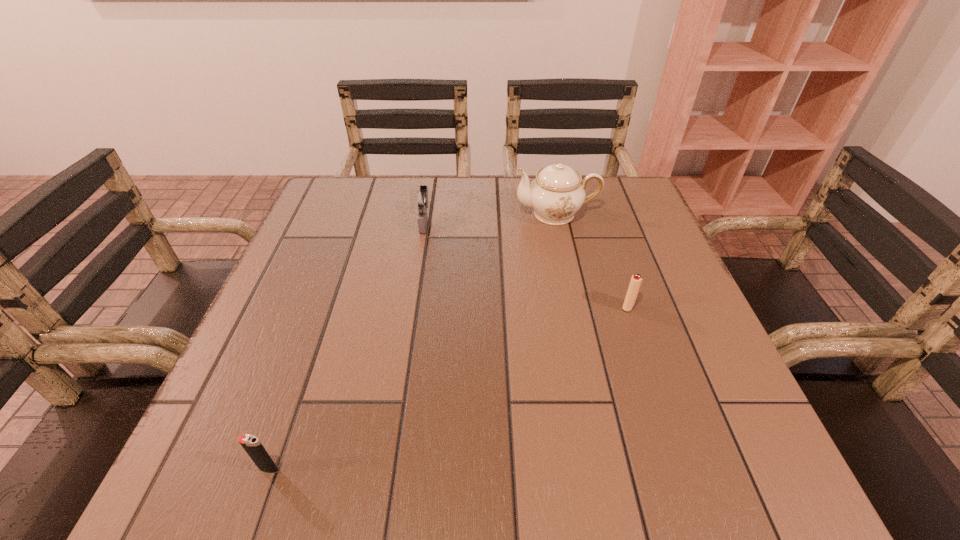
Locate an element on the screen. free space located 0.390m on the front of the tallest igniter is located at coordinates (402, 372).

Identify the location of vacant position located on the right of the leftmost object. This screenshot has height=540, width=960. (464, 469).

At what (x,y) coordinates should I click in order to perform the action: click on vacant position located 0.050m on the right of the second nearest object. Please return your answer as a coordinate pair (x, y). This screenshot has height=540, width=960. Looking at the image, I should click on (660, 307).

What are the coordinates of `chinaware located at the far edge` in the screenshot? It's located at (556, 194).

Image resolution: width=960 pixels, height=540 pixels. Identify the location of igniter located at the far edge. pos(421,199).

Where is `object at the near edge`? object at the near edge is located at coordinates pos(251,444).

Identify the location of object present at the left edge. The image size is (960, 540). (251, 444).

Image resolution: width=960 pixels, height=540 pixels. What are the coordinates of `chinaware that is at the right edge` in the screenshot? It's located at (556, 194).

Find the location of a particular element. The width and height of the screenshot is (960, 540). igniter that is at the right edge is located at coordinates (636, 280).

At what (x,y) coordinates should I click in order to perform the action: click on object situated at the near left corner. Please return your answer as a coordinate pair (x, y). The image size is (960, 540). Looking at the image, I should click on (251, 444).